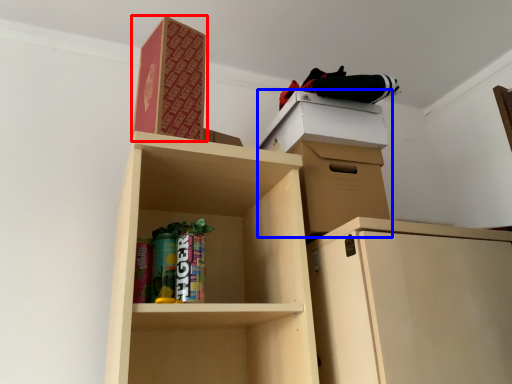
Question: Which object appears farthest to the camera in this image, paperback book (highlighted by a red box) or cabinetry (highlighted by a blue box)?

Choices:
 (A) paperback book
 (B) cabinetry

Answer: (B)